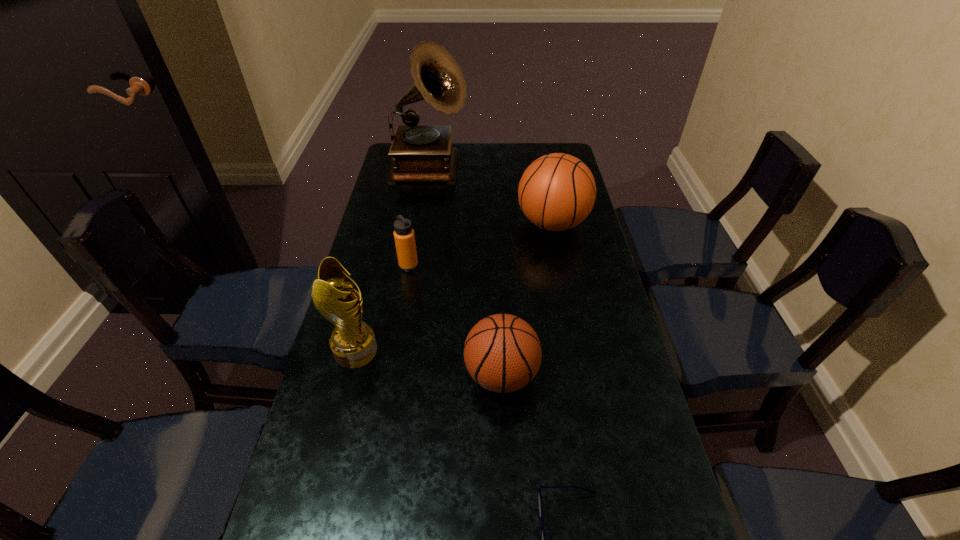
Identify the location of vacant area in the image that satisfies the following two spatial constraints: 1. on the horn of the tallest object; 2. on the back side of the farther basketball. (421, 224).